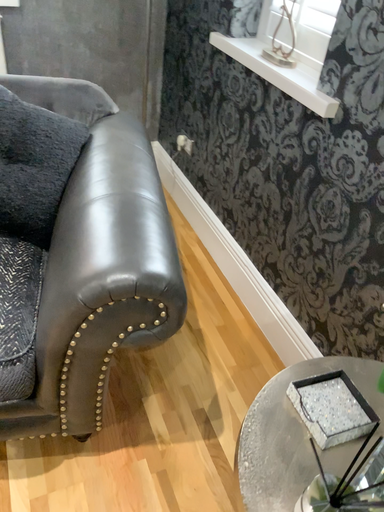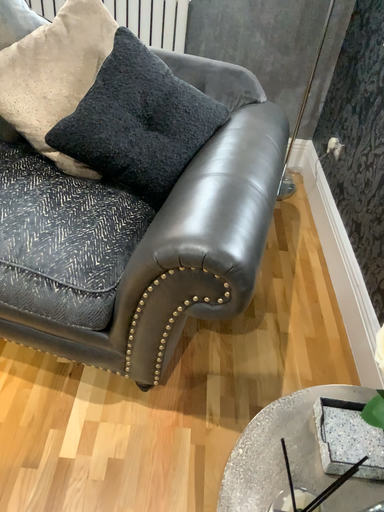
Question: How did the camera likely rotate when shooting the video?

Choices:
 (A) rotated right
 (B) rotated left

Answer: (B)